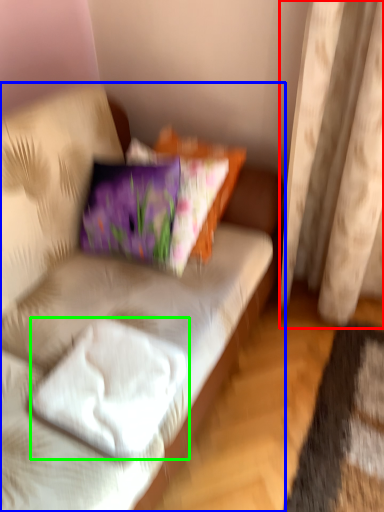
Question: Which is nearer to the curtain (highlighted by a red box)? studio couch (highlighted by a blue box) or pillow (highlighted by a green box).

Choices:
 (A) studio couch
 (B) pillow

Answer: (A)